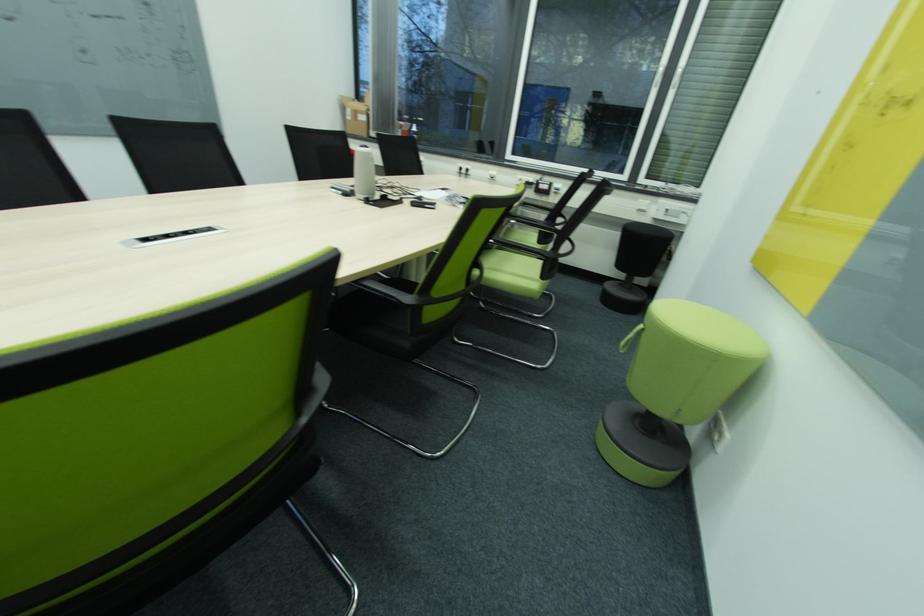
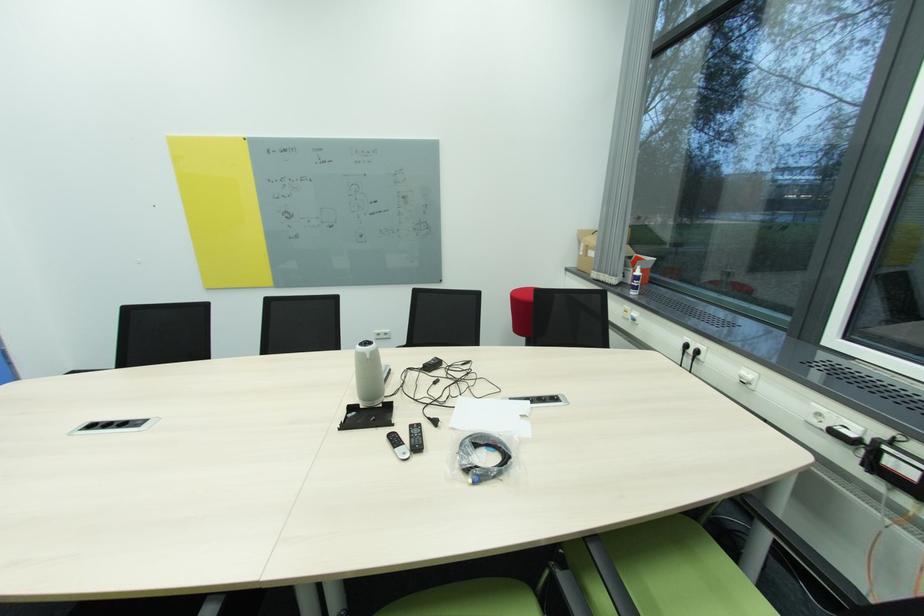
Locate, in the second image, the point that corresponds to (x=360, y=114) in the first image.

(591, 249)